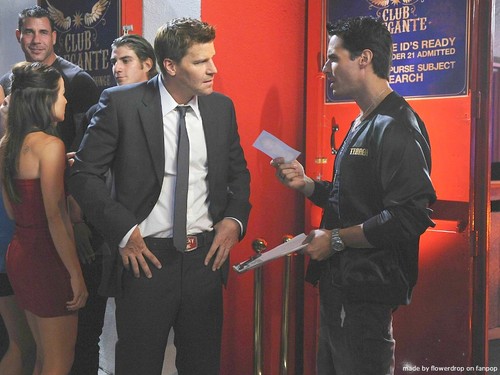
The image size is (500, 375). What are the coordinates of `long silver handles` in the screenshot? It's located at (257, 280), (285, 283).